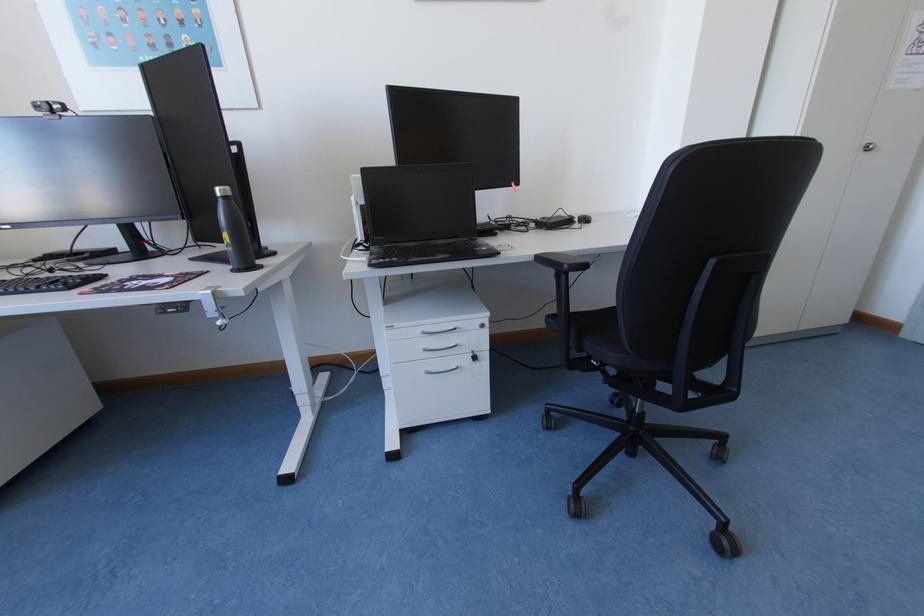
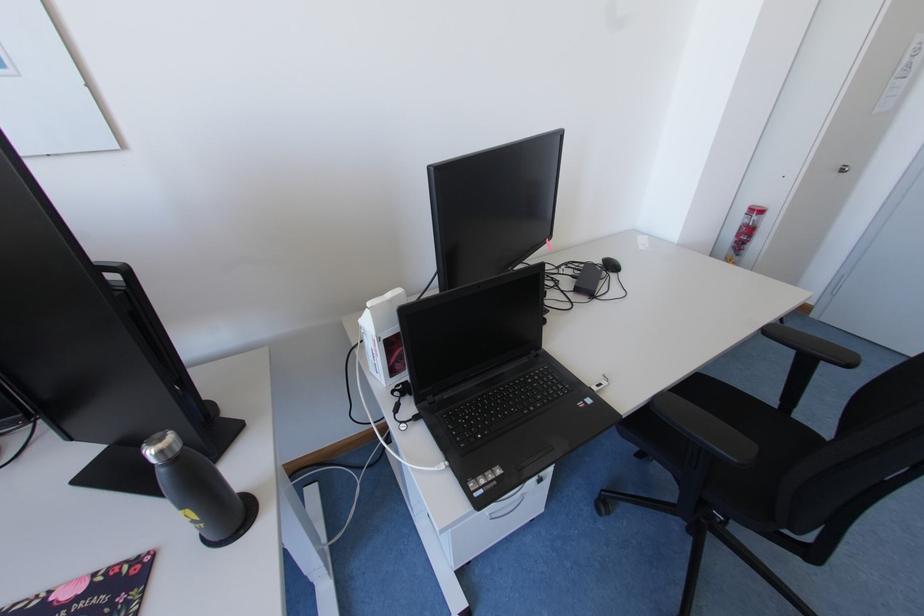
Question: Based on the continuous images, in which direction is the camera rotating? Reply with the corresponding letter.

Choices:
 (A) Left
 (B) Right
 (C) Up
 (D) Down

Answer: (B)